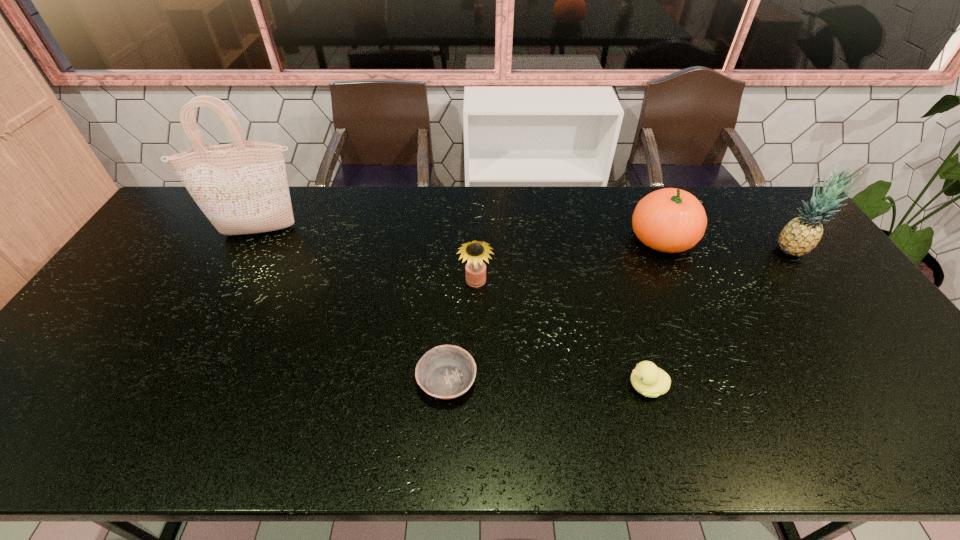
At what (x,y) coordinates should I click in order to perform the action: click on free location located 0.340m on the front of the second tallest object. Please return your answer as a coordinate pair (x, y). Looking at the image, I should click on (868, 354).

This screenshot has height=540, width=960. What are the coordinates of `vacant space located 0.150m on the face of the fourth farthest object` in the screenshot? It's located at (475, 337).

The width and height of the screenshot is (960, 540). What are the coordinates of `free space located on the right of the second object from right to left` in the screenshot? It's located at 767,238.

Identify the location of vacant area situated at the beak of the fifth tallest object. The width and height of the screenshot is (960, 540). (539, 386).

Locate an element on the screen. vacant space located at the beak of the fifth tallest object is located at coordinates (551, 386).

The height and width of the screenshot is (540, 960). Find the location of `free space located 0.200m at the beak of the fifth tallest object`. free space located 0.200m at the beak of the fifth tallest object is located at coordinates (542, 386).

Find the location of `free region located 0.160m on the left of the bowl`. free region located 0.160m on the left of the bowl is located at coordinates (350, 381).

Locate an element on the screen. shopping bag at the far edge is located at coordinates pyautogui.click(x=242, y=188).

This screenshot has height=540, width=960. What are the coordinates of `pumpkin located in the far edge section of the desktop` in the screenshot? It's located at (671, 220).

In order to click on object present at the right edge in this screenshot , I will do `click(801, 235)`.